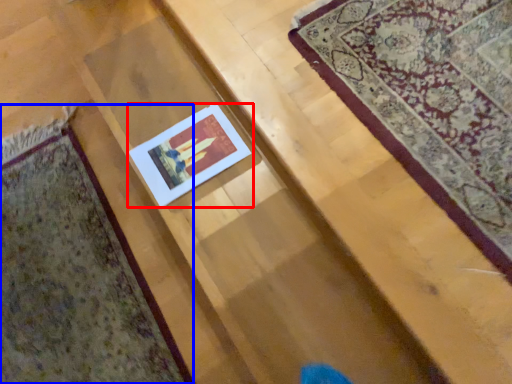
Question: Which of the following is the farthest to the observer, picture frame (highlighted by a red box) or mat (highlighted by a blue box)?

Choices:
 (A) picture frame
 (B) mat

Answer: (A)